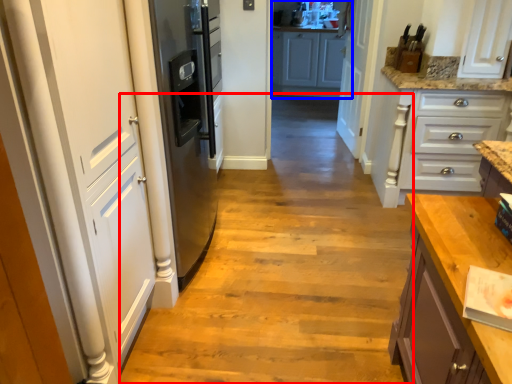
Question: Which object appears farthest to the camera in this image, path (highlighted by a red box) or cabinetry (highlighted by a blue box)?

Choices:
 (A) path
 (B) cabinetry

Answer: (B)